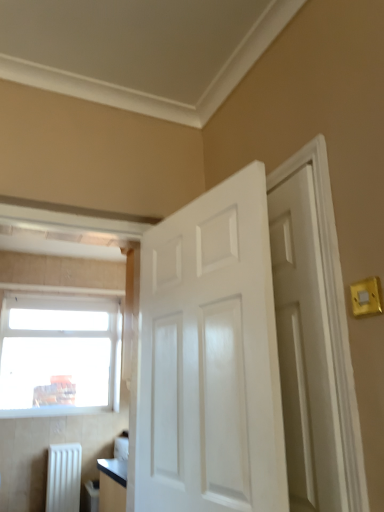
Question: Based on their positions, is white glossy door at center, the 2th door positioned from the right, located to the left or right of yellow plastic light switch at upper right?

Choices:
 (A) left
 (B) right

Answer: (A)

Question: Considering the positions of point (231, 394) and point (369, 290), is point (231, 394) closer or farther from the camera than point (369, 290)?

Choices:
 (A) farther
 (B) closer

Answer: (A)

Question: Considering the real-world distances, which object is farthest from the transparent glass window at upper left?

Choices:
 (A) white glossy door at right, which is counted as the 2th door, starting from the left
 (B) white matte radiator at lower left
 (C) white glossy door at center, positioned as the 1th door in left-to-right order
 (D) yellow plastic light switch at upper right

Answer: (D)

Question: Based on their relative distances, which object is nearer to the transparent glass window at upper left?

Choices:
 (A) yellow plastic light switch at upper right
 (B) white matte radiator at lower left
 (C) white glossy door at right, which is counted as the 2th door, starting from the left
 (D) white glossy door at center, the 2th door positioned from the right

Answer: (B)